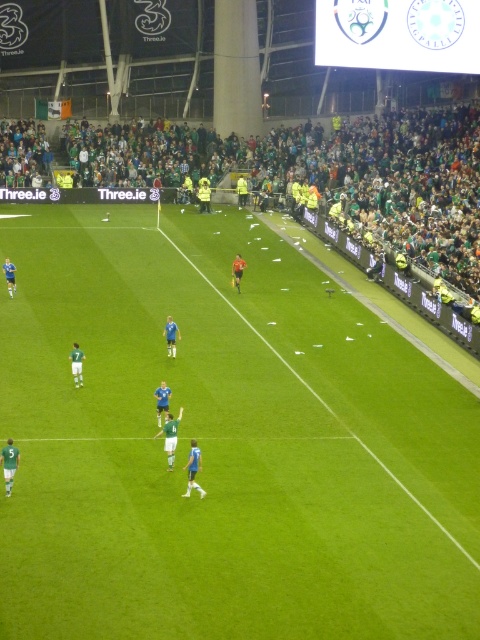
Is point (301, 420) closer to camera compared to point (4, 148)?

Yes, point (301, 420) is in front of point (4, 148).

The height and width of the screenshot is (640, 480). In order to click on green grass field at center in this screenshot , I will do `click(222, 444)`.